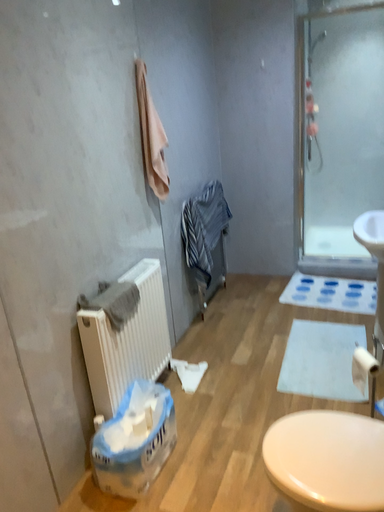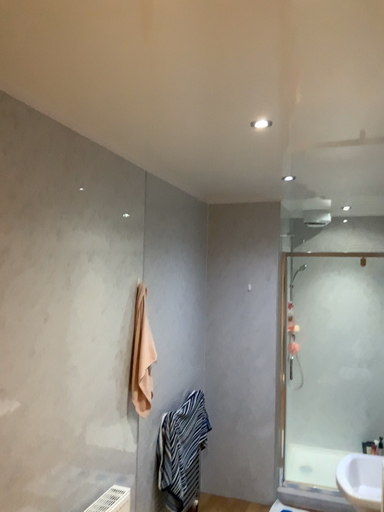
Question: Which way did the camera rotate in the video?

Choices:
 (A) rotated downward
 (B) rotated upward

Answer: (B)